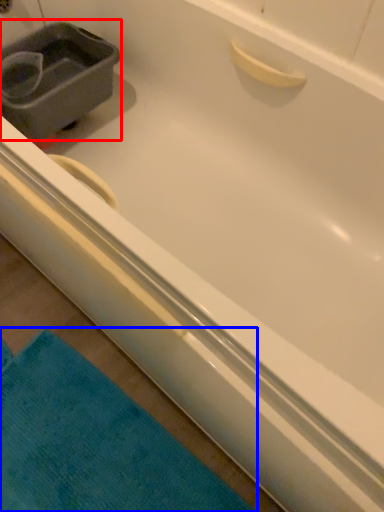
Question: Which object is further to the camera taking this photo, sink (highlighted by a red box) or bath towel (highlighted by a blue box)?

Choices:
 (A) sink
 (B) bath towel

Answer: (A)